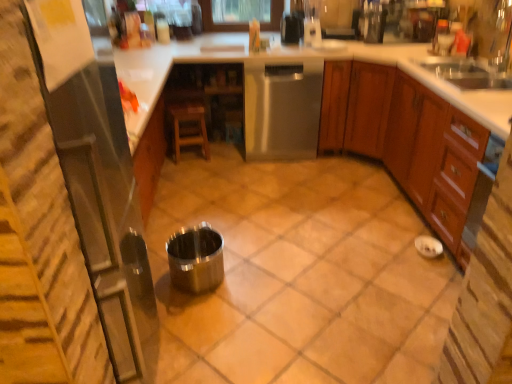
Question: Can you confirm if clear glass blender at upper center, the 4th appliance from the left, is positioned to the right of stainless steel trash can at center, the fifth appliance when ordered from right to left?

Choices:
 (A) yes
 (B) no

Answer: (A)

Question: Can you confirm if clear glass blender at upper center, positioned as the 1th appliance in back-to-front order, is shorter than stainless steel trash can at center, the second appliance positioned from the bottom?

Choices:
 (A) no
 (B) yes

Answer: (B)

Question: Is clear glass blender at upper center, arranged as the fifth appliance when ordered from the bottom, further to the viewer compared to stainless steel trash can at center, the fifth appliance when ordered from right to left?

Choices:
 (A) yes
 (B) no

Answer: (A)

Question: Is clear glass blender at upper center, the second appliance viewed from the right, positioned before stainless steel trash can at center, which ranks as the fourth appliance in top-to-bottom order?

Choices:
 (A) no
 (B) yes

Answer: (A)

Question: Is clear glass blender at upper center, the 4th appliance from the left, smaller than stainless steel trash can at center, the 5th appliance from the back?

Choices:
 (A) yes
 (B) no

Answer: (A)

Question: Is clear glass blender at upper center, which is the 1th appliance from top to bottom, outside stainless steel trash can at center, which ranks as the fourth appliance in top-to-bottom order?

Choices:
 (A) yes
 (B) no

Answer: (A)

Question: From the image's perspective, is stainless steel trash can at center, which ranks as the fourth appliance in top-to-bottom order, located beneath polished metallic cup at center, the 1th appliance from the bottom?

Choices:
 (A) no
 (B) yes

Answer: (A)

Question: Considering the relative positions of stainless steel trash can at center, the second appliance positioned from the bottom, and polished metallic cup at center, the 1th appliance from the bottom, in the image provided, is stainless steel trash can at center, the second appliance positioned from the bottom, to the left of polished metallic cup at center, the 1th appliance from the bottom, from the viewer's perspective?

Choices:
 (A) yes
 (B) no

Answer: (A)

Question: From a real-world perspective, is stainless steel trash can at center, the second appliance positioned from the bottom, on top of polished metallic cup at center, the 1th appliance from the bottom?

Choices:
 (A) yes
 (B) no

Answer: (A)

Question: Is stainless steel trash can at center, the 5th appliance from the back, oriented away from polished metallic cup at center, marked as the 5th appliance in a top-to-bottom arrangement?

Choices:
 (A) no
 (B) yes

Answer: (A)

Question: Could you tell me if stainless steel trash can at center, the 5th appliance from the back, is facing polished metallic cup at center, placed as the 2th appliance when sorted from left to right?

Choices:
 (A) yes
 (B) no

Answer: (B)

Question: Is polished metallic cup at center, positioned as the 4th appliance in right-to-left order, located within stainless steel trash can at center, the first appliance from the left?

Choices:
 (A) yes
 (B) no

Answer: (B)

Question: Could you tell me if clear glass blender at upper center, arranged as the fifth appliance when ordered from the bottom, is turned towards stainless steel dishwasher at center?

Choices:
 (A) yes
 (B) no

Answer: (B)